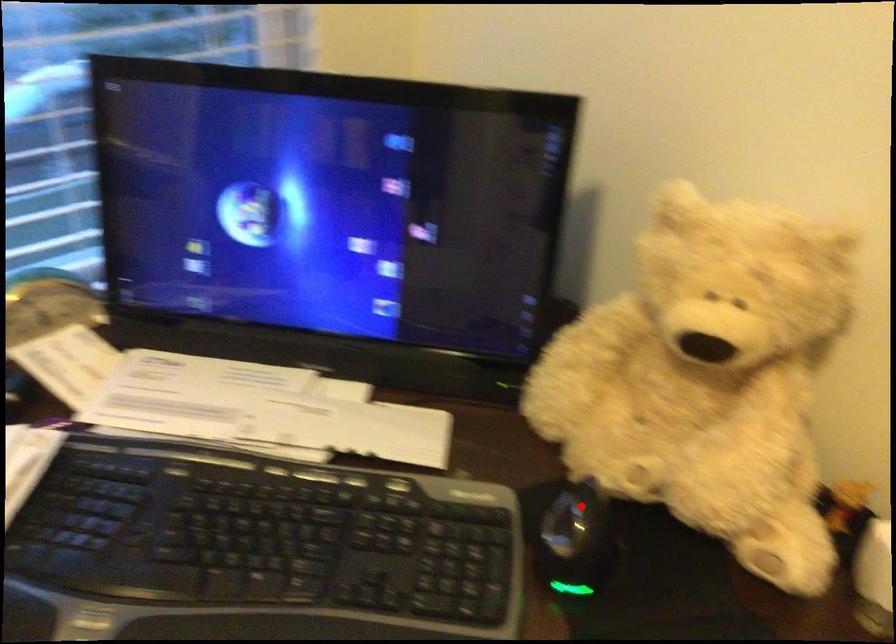
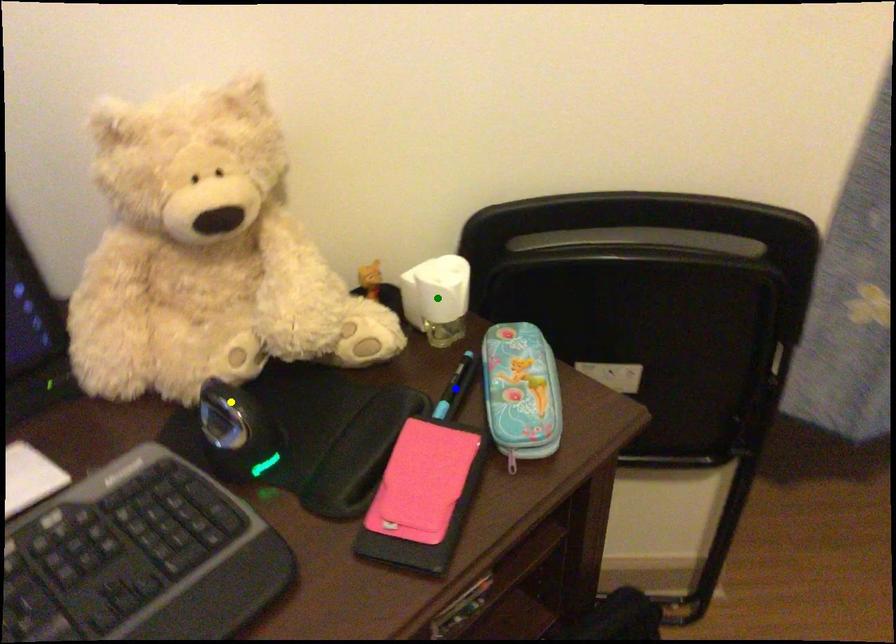
Question: I am providing you with two images of the same scene from different viewpoints. A red point is marked on the first image. You are given multiple points on the second image. Can you choose the point in image 2 that corresponds to the point in image 1?

Choices:
 (A) yellow point
 (B) blue point
 (C) green point

Answer: (A)